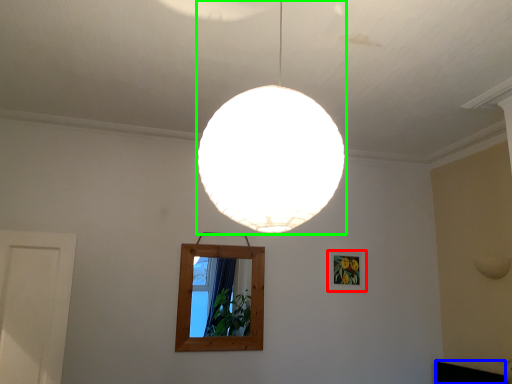
Question: Based on their relative distances, which object is nearer to picture frame (highlighted by a red box)? Choose from furniture (highlighted by a blue box) and lamp (highlighted by a green box).

Choices:
 (A) furniture
 (B) lamp

Answer: (A)